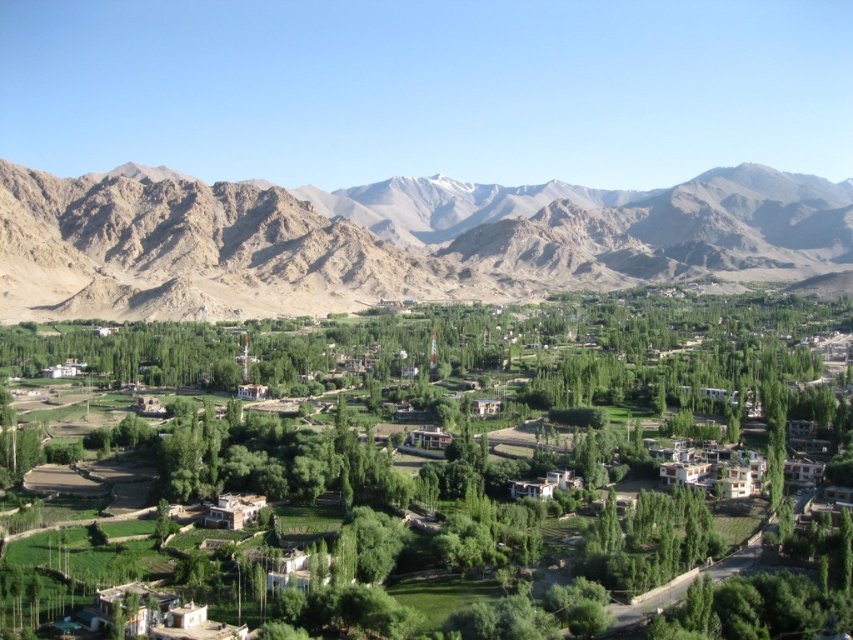
Question: Which point is farther from the camera taking this photo?

Choices:
 (A) (728, 196)
 (B) (645, 352)

Answer: (A)

Question: Which of the following is the closest to the observer?

Choices:
 (A) rugged brown mountains at upper left
 (B) green leafy tree at center

Answer: (B)

Question: Is green leafy tree at center thinner than rugged brown mountains at upper left?

Choices:
 (A) yes
 (B) no

Answer: (A)

Question: Which point is farther to the camera?

Choices:
 (A) (164, 276)
 (B) (718, 429)

Answer: (A)

Question: Is green leafy tree at center positioned behind rugged brown mountains at upper left?

Choices:
 (A) no
 (B) yes

Answer: (A)

Question: In this image, where is green leafy tree at center located relative to rugged brown mountains at upper left?

Choices:
 (A) below
 (B) above

Answer: (A)